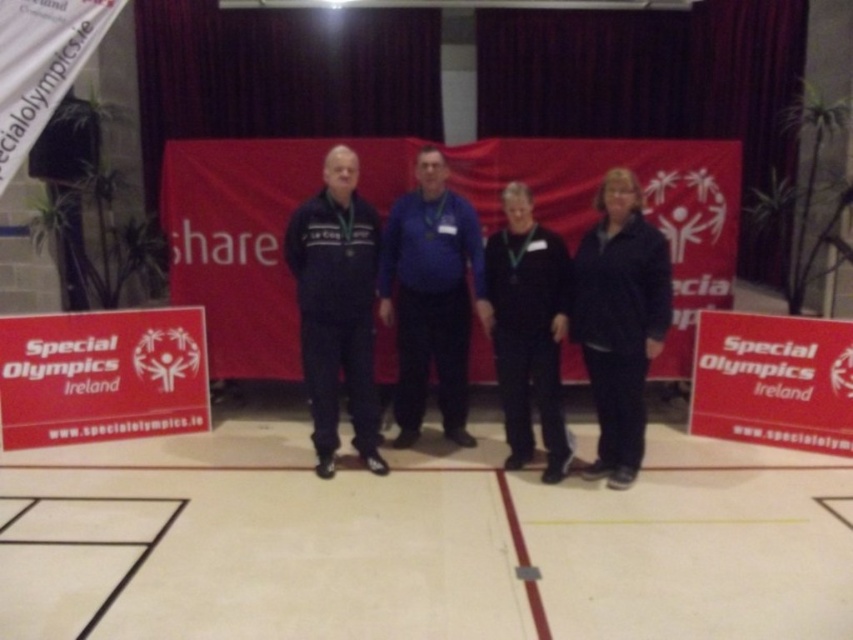
Between point (590, 346) and point (555, 461), which one is positioned behind?

Positioned behind is point (555, 461).

Is point (589, 246) farther from camera compared to point (492, 241)?

That is False.

Identify the location of dark blue jacket at center. (619, 321).

What do you see at coordinates (431, 296) in the screenshot?
I see `blue fabric shirt at center` at bounding box center [431, 296].

Who is more distant from viewer, (397,314) or (631,188)?

Positioned behind is point (397,314).

Is point (393, 244) positioned in front of point (624, 372)?

No.

At what (x,y) coordinates should I click in order to perform the action: click on blue fabric shirt at center. Please return your answer as a coordinate pair (x, y). This screenshot has width=853, height=640. Looking at the image, I should click on (431, 296).

Can you confirm if blue fabric shirt at center is bigger than matte blue tracksuit at center?

Indeed, blue fabric shirt at center has a larger size compared to matte blue tracksuit at center.

Is blue fabric shirt at center to the right of matte blue tracksuit at center from the viewer's perspective?

Correct, you'll find blue fabric shirt at center to the right of matte blue tracksuit at center.

The image size is (853, 640). Find the location of `blue fabric shirt at center`. blue fabric shirt at center is located at coordinates (431, 296).